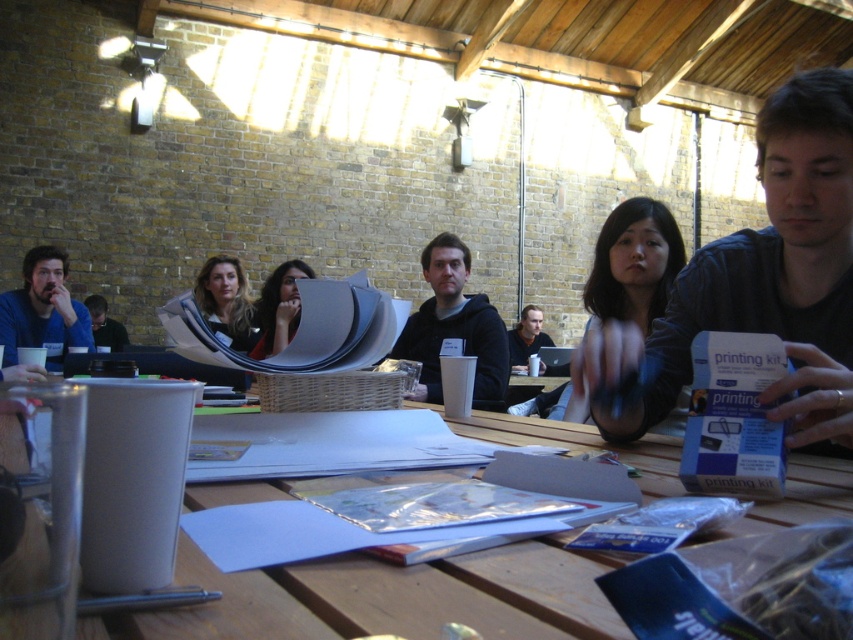
How far apart are wooden picnic table at center and matte black laptop at center?

wooden picnic table at center is 3.79 meters away from matte black laptop at center.

Who is more forward, (578,616) or (518,333)?

Point (578,616) is more forward.

You are a GUI agent. You are given a task and a screenshot of the screen. Output one action in this format:
    pyautogui.click(x=<x>, y=<y>)
    Task: Click on the wooden picnic table at center
    
    Given the screenshot: What is the action you would take?
    pyautogui.click(x=387, y=596)

Which is in front, point (57, 394) or point (107, 330)?

Point (57, 394) is in front.

Does point (387, 596) come in front of point (112, 323)?

Yes, point (387, 596) is in front of point (112, 323).

In the scene shown: Measure the distance between point (759, 516) and camera.

A distance of 21.86 inches exists between point (759, 516) and camera.

Find the location of a particular element. wooden picnic table at center is located at coordinates (387, 596).

Is matte black paper at center above matte black laptop at center?

Indeed, matte black paper at center is positioned over matte black laptop at center.

Is point (256, 346) positioned behind point (524, 314)?

No, (256, 346) is in front of (524, 314).

Which is in front, point (283, 282) or point (515, 353)?

Point (283, 282) is more forward.

You are a GUI agent. You are given a task and a screenshot of the screen. Output one action in this format:
    pyautogui.click(x=<x>, y=<y>)
    Task: Click on the matte black paper at center
    This screenshot has width=853, height=640.
    Given the screenshot: What is the action you would take?
    [x=279, y=307]